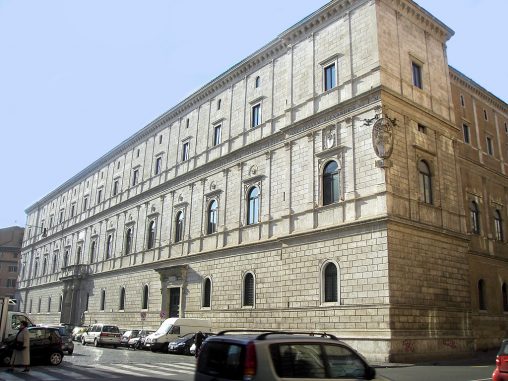
The image size is (508, 381). What are the coordinates of `coat` in the screenshot? It's located at (24, 338).